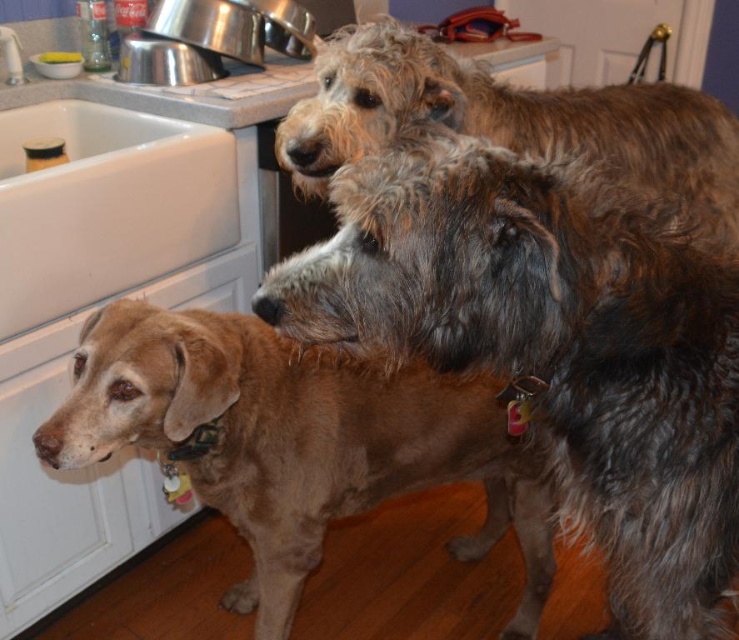
You are a photographer setting up a shot of the two fuzzy brown dogs. You want to ensure the dog closer to the camera is in focus while the background dog is blurred. Which dog should you focus on, the fuzzy brown dog at center or the fuzzy brown dog at upper center?

You should focus on the fuzzy brown dog at center because it is closer to the viewer, and focusing on the closer dog will naturally blur the background dog at upper center.

You are trying to locate the fuzzy brown dog at center in the image. According to the coordinates provided, where exactly is it positioned?

The fuzzy brown dog at center is located at point 0.544 on the horizontal axis and 0.748 on the vertical axis.